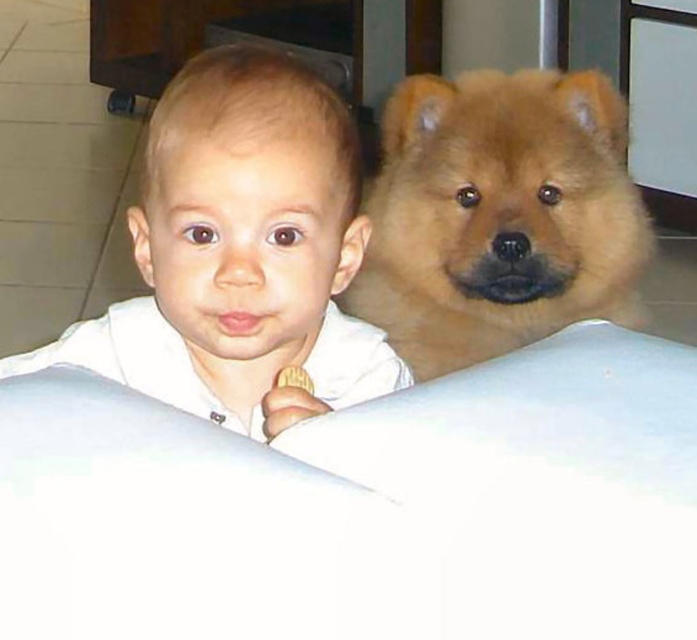
Question: Among these points, which one is nearest to the camera?

Choices:
 (A) (252, 332)
 (B) (427, 202)

Answer: (A)

Question: Is smooth white shirt at upper left wider than fluffy brown dog at upper right?

Choices:
 (A) no
 (B) yes

Answer: (A)

Question: Does smooth white shirt at upper left have a greater width compared to fluffy brown dog at upper right?

Choices:
 (A) no
 (B) yes

Answer: (A)

Question: Which of the following is the farthest from the observer?

Choices:
 (A) fluffy brown dog at upper right
 (B) smooth white shirt at upper left

Answer: (A)

Question: Is smooth white shirt at upper left above fluffy brown dog at upper right?

Choices:
 (A) yes
 (B) no

Answer: (B)